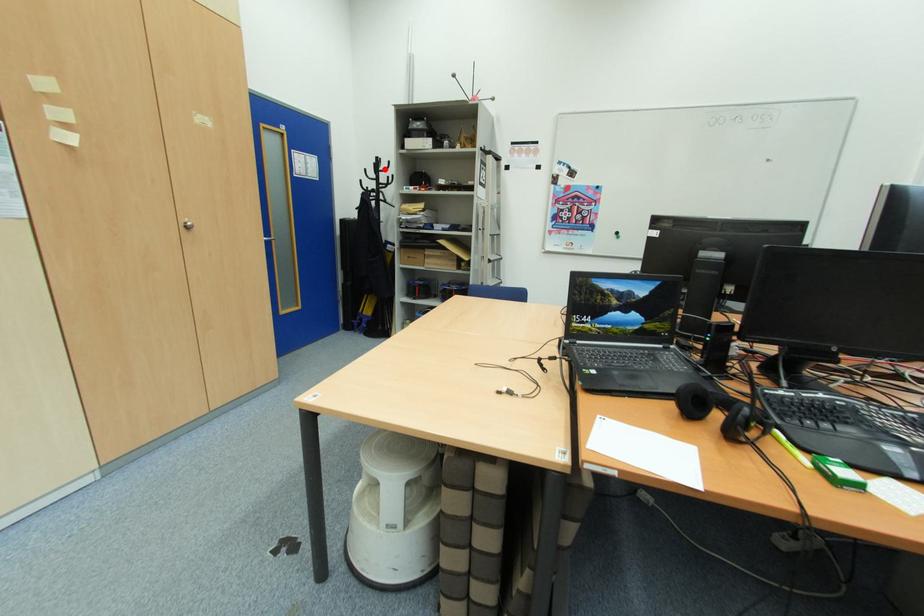
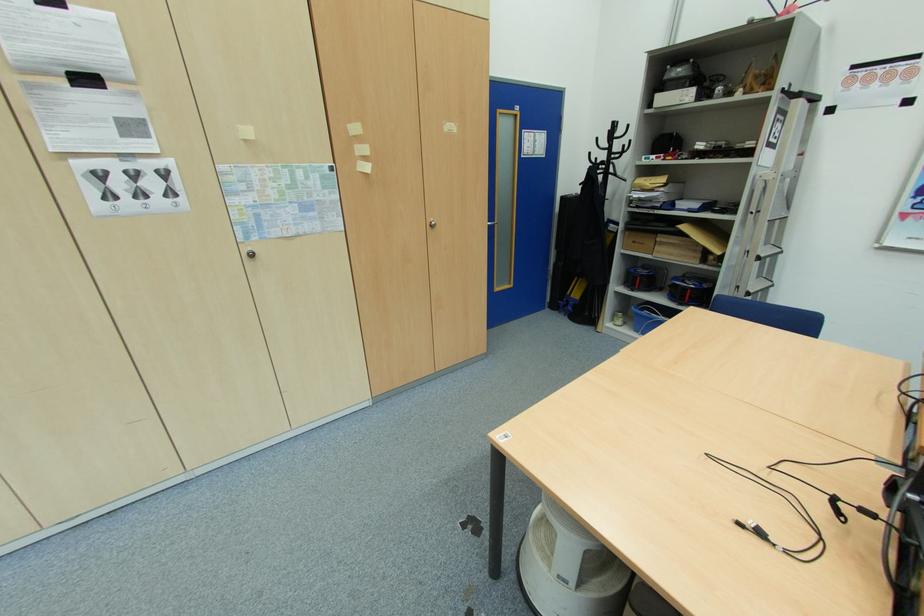
Find the pixel in the second image that matches the highlighted location in the first image.

(619, 136)